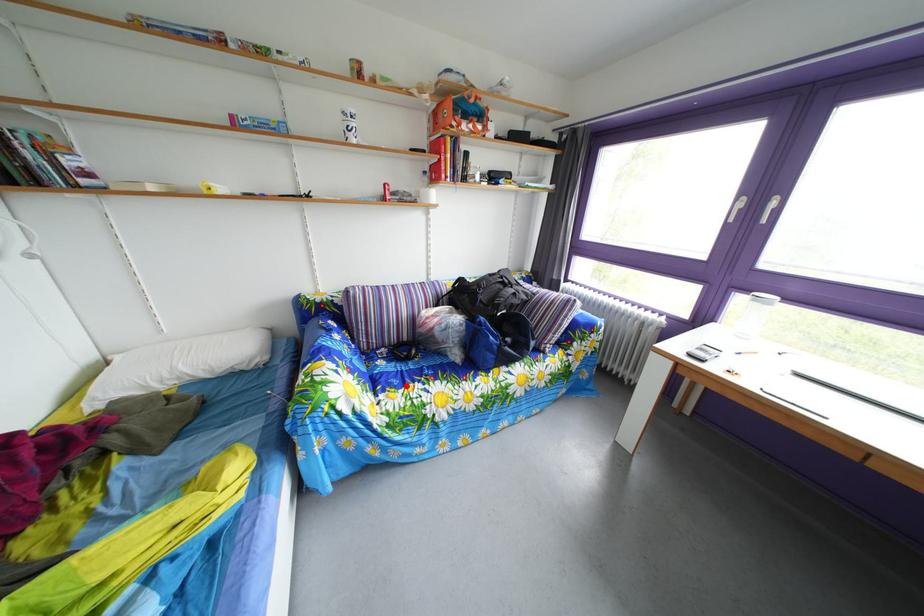
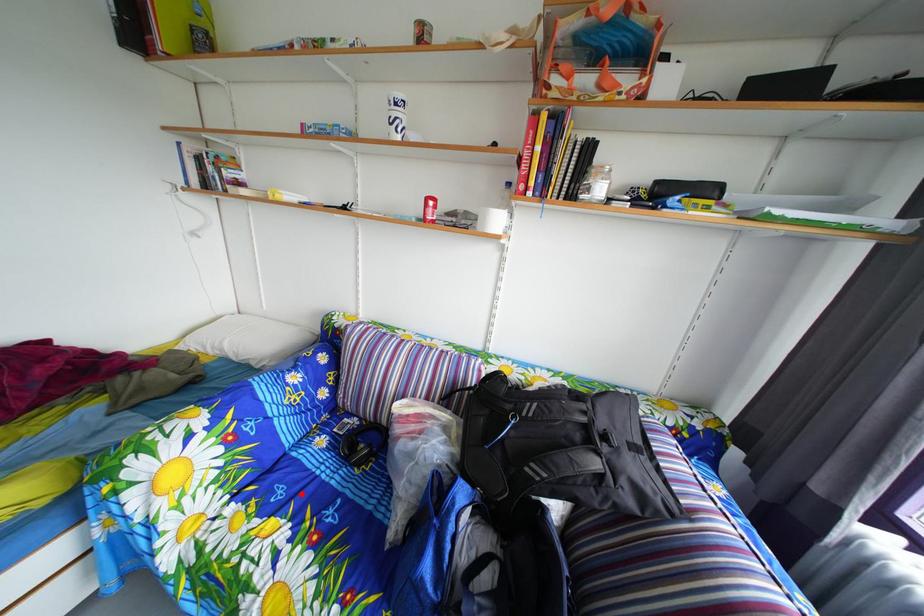
I am providing you with two images of the same scene from different viewpoints. A red point is marked on the first image and another point is marked on the second image. Do the highlighted points in image1 and image2 indicate the same real-world spot?

Yes